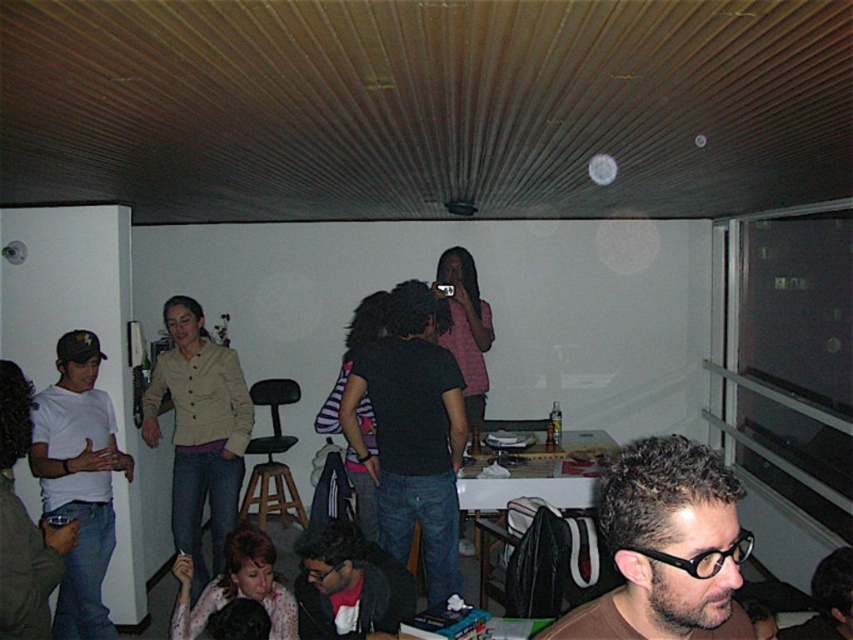
You are standing at the entrance of the room and want to take a photo that includes both the white door with a visible handle and the point at coordinates point (291,476). However, you notice that the telephone mounted on the wall is blocking your view of the point at coordinates point (682,481). To ensure both points are visible in your photo, should you move closer to or further away from the telephone?

Since point (682,481) is closer to the camera than point (291,476), moving closer to the telephone would bring point (682,481) into a clearer focus while ensuring that point (291,476) remains in the frame. However, if the telephone is obstructing the view of point (682,481), you might need to adjust your position slightly to the side to avoid the obstruction while maintaining both points within the camera frame.